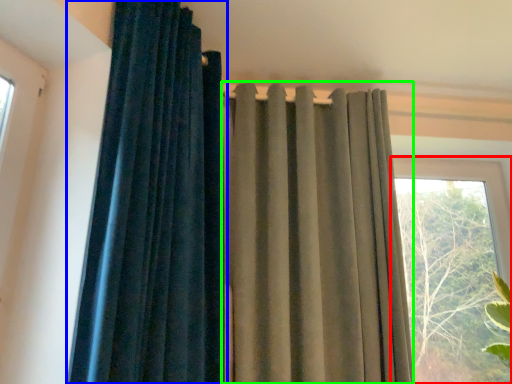
Question: Based on their relative distances, which object is farther from window (highlighted by a red box)? Choose from curtain (highlighted by a blue box) and curtain (highlighted by a green box).

Choices:
 (A) curtain
 (B) curtain

Answer: (A)